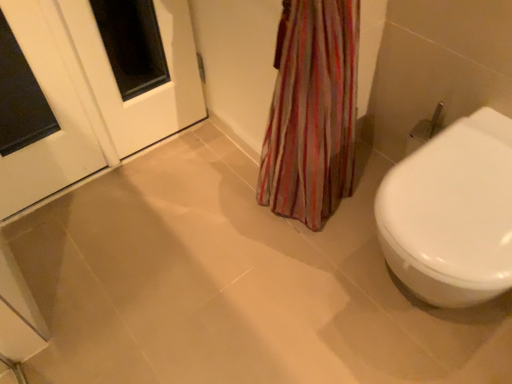
Where is `vacant area located to the right-hand side of white glossy door at upper left`? vacant area located to the right-hand side of white glossy door at upper left is located at coordinates click(214, 161).